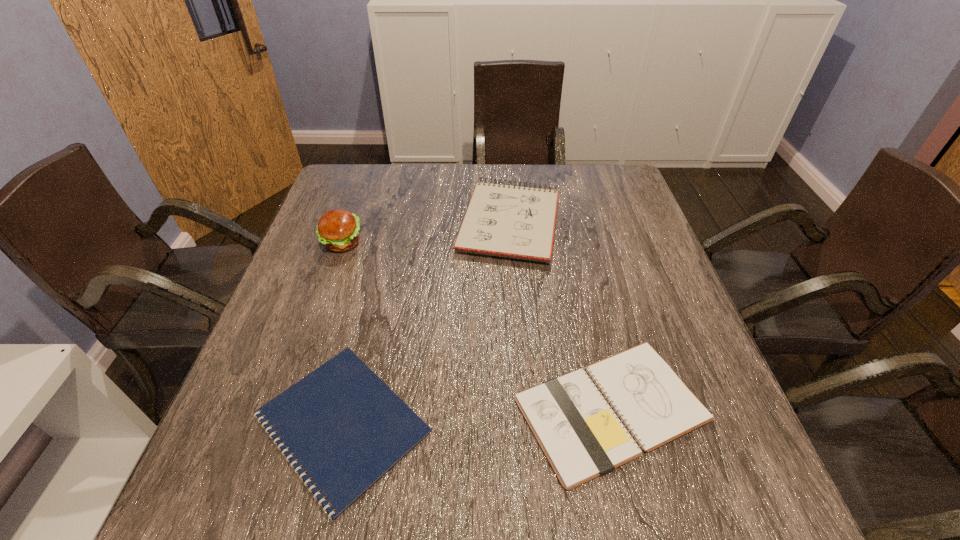
Image resolution: width=960 pixels, height=540 pixels. Identify the location of object positioned at the far edge. (517, 222).

Where is `hamburger positioned at the left edge`? The width and height of the screenshot is (960, 540). hamburger positioned at the left edge is located at coordinates (338, 230).

Where is `notepad situated at the left edge`? notepad situated at the left edge is located at coordinates (343, 424).

Identify the location of object located in the right edge section of the desktop. This screenshot has height=540, width=960. (582, 438).

In order to click on object present at the near left corner in this screenshot , I will do point(343,424).

Locate an element on the screen. This screenshot has width=960, height=540. object present at the near right corner is located at coordinates (582, 438).

Image resolution: width=960 pixels, height=540 pixels. I want to click on blank area at the far edge, so click(x=405, y=194).

Locate an element on the screen. vacant region at the left edge is located at coordinates (350, 257).

Locate an element on the screen. The image size is (960, 540). free space at the right edge of the desktop is located at coordinates (614, 246).

The image size is (960, 540). In order to click on vacant space at the far left corner of the desktop in this screenshot , I will do `click(357, 202)`.